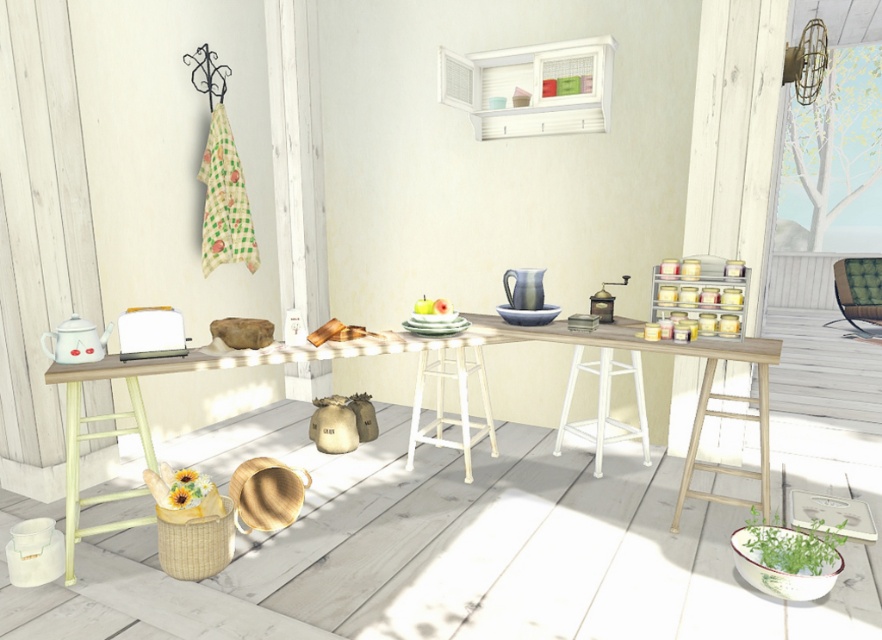
Question: Does white plastic stool at center appear on the left side of white wooden stool at center?

Choices:
 (A) no
 (B) yes

Answer: (B)

Question: Observing the image, what is the correct spatial positioning of white plastic stool at center in reference to white wooden stool at center?

Choices:
 (A) below
 (B) above

Answer: (B)

Question: Based on their relative distances, which object is nearer to the white wooden stool at center?

Choices:
 (A) wooden table at left
 (B) green fabric chair at right
 (C) white plastic stool at center

Answer: (A)

Question: Estimate the real-world distances between objects in this image. Which object is farther from the white wooden stool at center?

Choices:
 (A) wooden table at left
 (B) green fabric chair at right

Answer: (B)

Question: Is the position of white plastic stool at center more distant than that of green fabric chair at right?

Choices:
 (A) yes
 (B) no

Answer: (B)

Question: Which point is farther to the camera?

Choices:
 (A) white plastic stool at center
 (B) wooden table at left
 (C) green fabric chair at right
 (D) white wooden stool at center

Answer: (C)